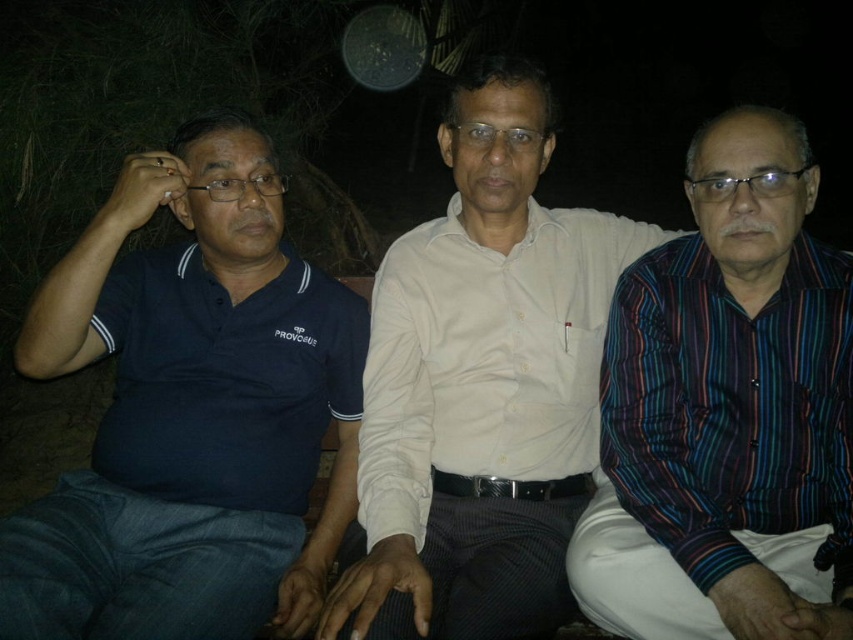
You are a photographer who wants to capture a closeup of the dark blue polo shirt at left. What coordinates should you focus on to ensure the shirt is centered in your shot?

You should focus on the coordinates point [190,412] to center the dark blue polo shirt at left in your shot.

What is the color of the shirt worn by the man located at point [190,412]?

The dark blue polo shirt at left is represented by point [190,412].